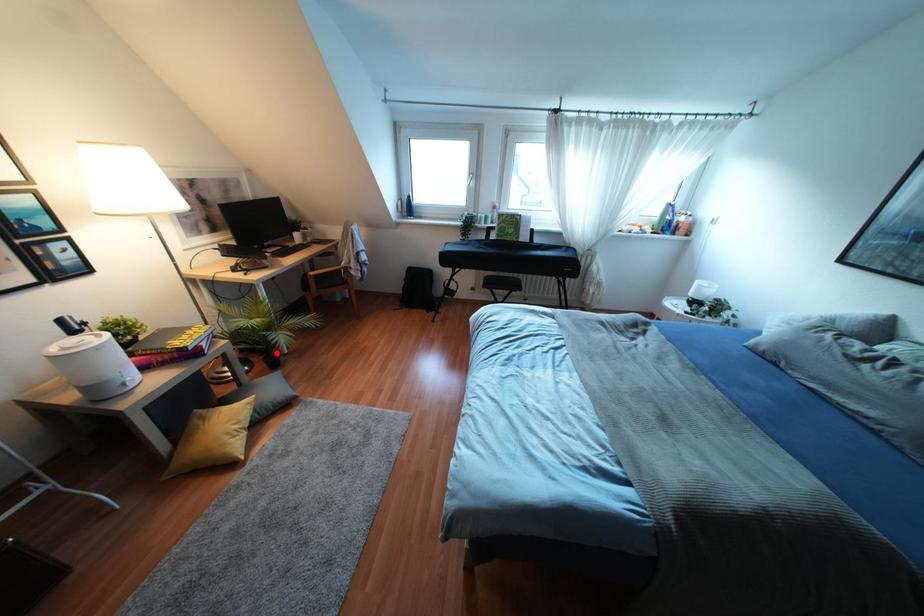
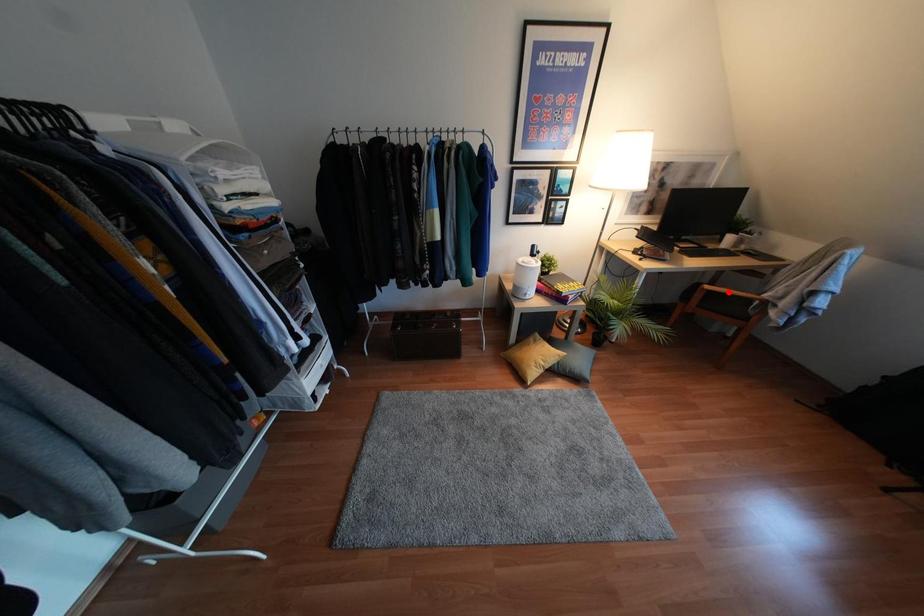
I am providing you with two images of the same scene from different viewpoints. A red point is marked on the first image and another point is marked on the second image. Is the marked point in image1 the same physical position as the marked point in image2?

No